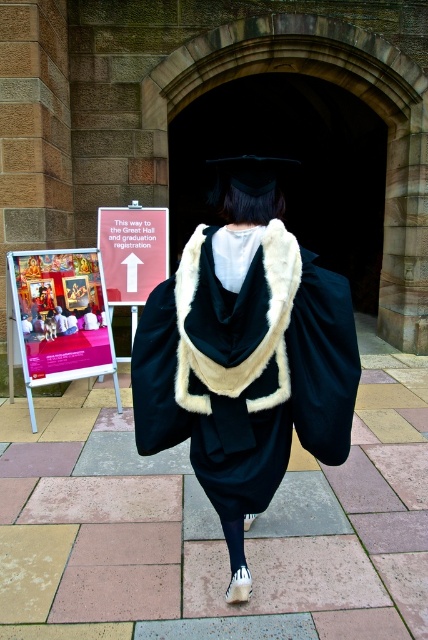
You are standing at the viewer position in the image and want to reach the signpost mentioned in the scene. The signpost is located at point (269, 496). Given that you can walk 10 feet per minute, how many minutes will it take you to reach the signpost?

The distance between the viewer and the signpost at point (269, 496) is 8.46 feet. At a walking speed of 10 feet per minute, it would take approximately 0.846 minutes, which is roughly 51 seconds, to reach the signpost.

You are a visitor at the graduation ceremony and need to locate the registration area. You see a matte pink fabric poster at left and a white paper sign at center. Which one is nearer to you?

The matte pink fabric poster at left is closer to the viewer than the white paper sign at center.

You are standing at the point labeled point (330, 444) and want to walk to point (70, 378). Given that both points are on the ground in the scene, which direction should you move relative to your current position?

You should move downward because point (70, 378) is further away from the viewer compared to point (330, 444), meaning it is located lower in the scene.